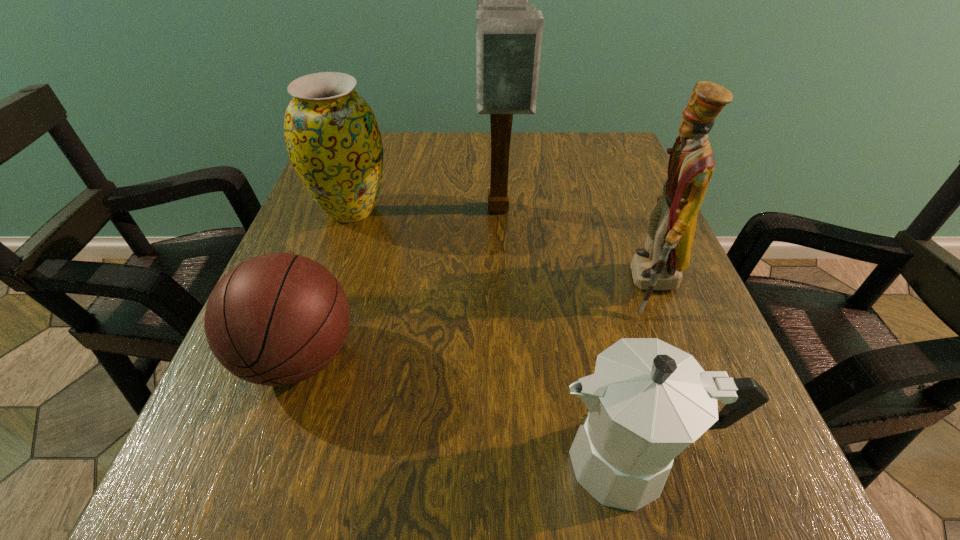
The height and width of the screenshot is (540, 960). I want to click on vacant space in between the third tallest object and the third object from right to left, so click(x=425, y=210).

The image size is (960, 540). Identify the location of free spot between the nutcracker and the mallet. (575, 248).

Image resolution: width=960 pixels, height=540 pixels. I want to click on free point between the nearest object and the third tallest object, so click(x=492, y=335).

I want to click on vacant space in between the shortest object and the second shortest object, so click(466, 409).

Where is `free space between the third tallest object and the third object from left to right`? free space between the third tallest object and the third object from left to right is located at coordinates (425, 210).

Find the location of a particular element. empty location between the basketball and the second tallest object is located at coordinates (475, 321).

The height and width of the screenshot is (540, 960). In order to click on free spot between the mallet and the third shortest object in this screenshot , I will do `click(425, 210)`.

Where is `free spot between the basketball and the second tallest object`? The height and width of the screenshot is (540, 960). free spot between the basketball and the second tallest object is located at coordinates (475, 321).

At what (x,y) coordinates should I click in order to perform the action: click on object that is the fourth nearest to the basketball. Please return your answer as a coordinate pair (x, y). Image resolution: width=960 pixels, height=540 pixels. Looking at the image, I should click on (658, 266).

Identify the location of object that stands as the second closest to the vase. The width and height of the screenshot is (960, 540). (276, 319).